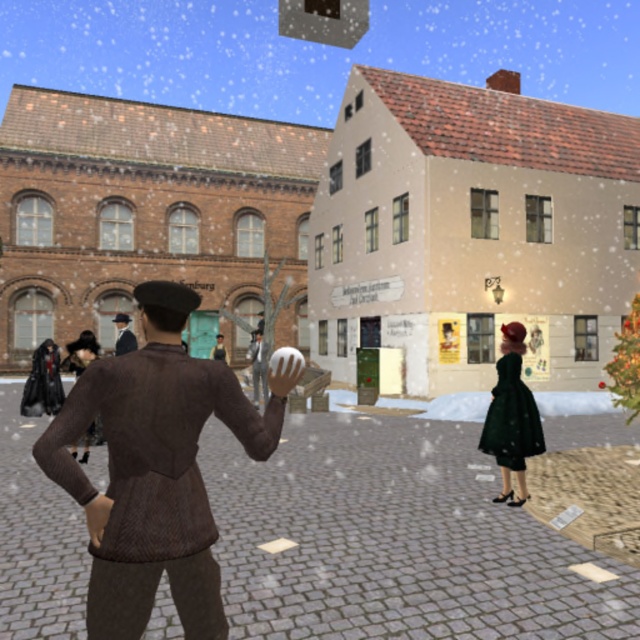
You are a GUI agent. You are given a task and a screenshot of the screen. Output one action in this format:
    pyautogui.click(x=<x>, y=<y>)
    Task: Click on the brown knitted sweater at center
    Image resolution: width=640 pixels, height=640 pixels.
    Given the screenshot: What is the action you would take?
    pyautogui.click(x=156, y=468)

Is point (141, 461) farther from camera compared to point (221, 339)?

No, (141, 461) is in front of (221, 339).

Describe the element at coordinates (156, 468) in the screenshot. I see `brown knitted sweater at center` at that location.

Identify the location of brown knitted sweater at center. (156, 468).

Looking at this image, does brown wool coat at center lie behind brown leather coat at center?

No, brown wool coat at center is closer to the viewer.

Is brown wool coat at center to the right of brown leather coat at center from the viewer's perspective?

Incorrect, brown wool coat at center is not on the right side of brown leather coat at center.

Which is behind, point (122, 314) or point (212, 348)?

The point (212, 348) is more distant.

Image resolution: width=640 pixels, height=640 pixels. Find the location of `brown wool coat at center`. brown wool coat at center is located at coordinates (124, 333).

At what (x,y) coordinates should I click in order to perform the action: click on velvet green dress at right. Please return your answer as a coordinate pair (x, y). This screenshot has height=640, width=640. Looking at the image, I should click on (512, 417).

Does velvet green dress at right appear over brown wool coat at center?

No.

Is point (509, 506) in front of point (120, 330)?

That is True.

Where is `velvet green dress at right`? velvet green dress at right is located at coordinates (512, 417).